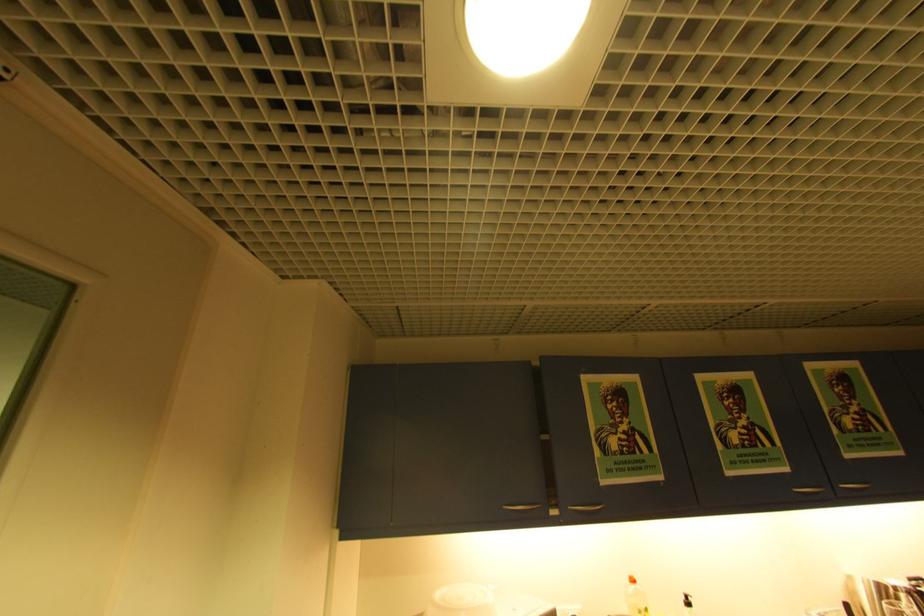
Where would you press the black soap dispenser? Please return your answer as a coordinate pair (x, y).

(688, 605)